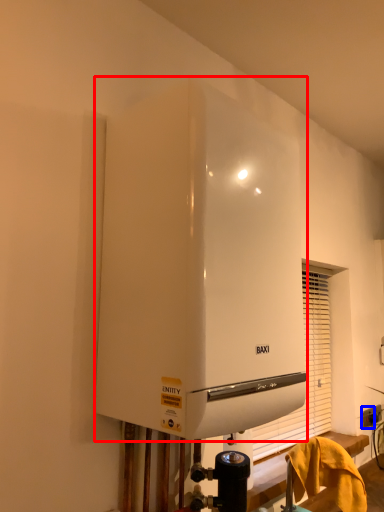
Question: Among these objects, which one is farthest to the camera, home appliance (highlighted by a red box) or electric outlet (highlighted by a blue box)?

Choices:
 (A) home appliance
 (B) electric outlet

Answer: (B)